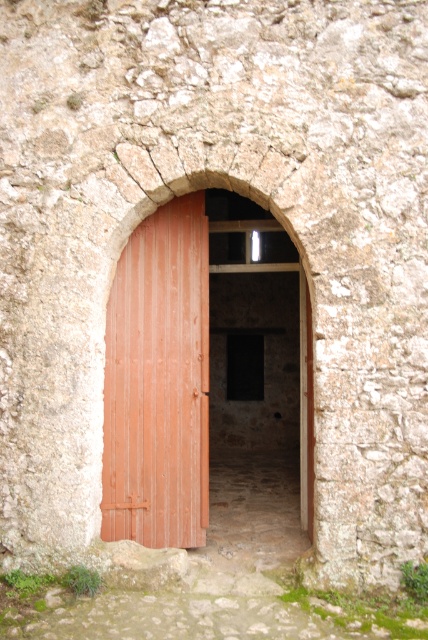
Is wooden door at center bigger than brown wooden door at center?

No, wooden door at center is not bigger than brown wooden door at center.

Is wooden door at center to the left of brown wooden door at center from the viewer's perspective?

No, wooden door at center is not to the left of brown wooden door at center.

Locate an element on the screen. Image resolution: width=428 pixels, height=640 pixels. wooden door at center is located at coordinates (207, 374).

Where is `wooden door at center`? The height and width of the screenshot is (640, 428). wooden door at center is located at coordinates (207, 374).